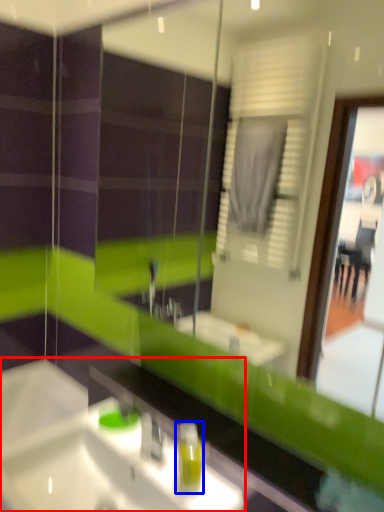
Question: Which object is closer to the camera taking this photo, sink (highlighted by a red box) or soap dispenser (highlighted by a blue box)?

Choices:
 (A) sink
 (B) soap dispenser

Answer: (A)